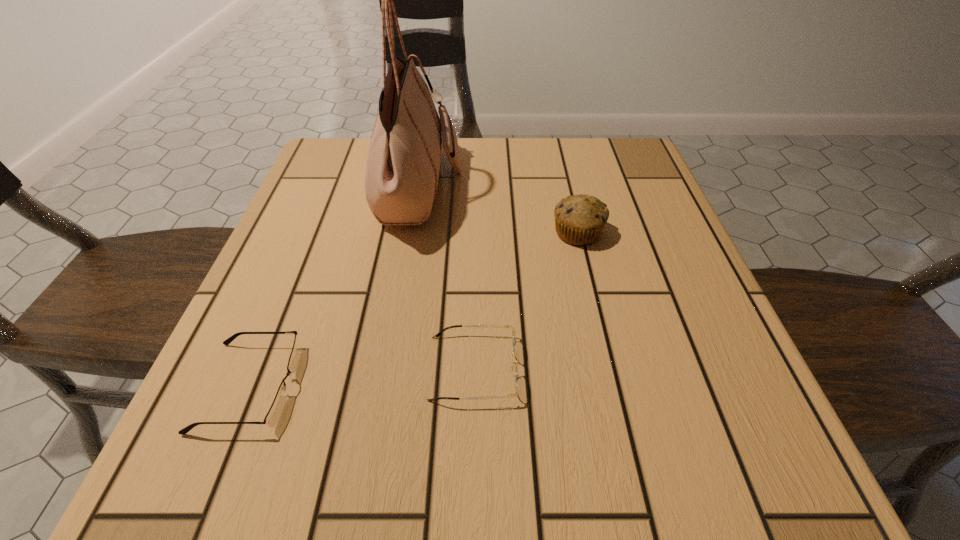
Point out which object is positioned as the nearest to the handbag. Please provide its 2D coordinates. Your answer should be formatted as a tuple, i.e. [(x, y)], where the tuple contains the x and y coordinates of a point satisfying the conditions above.

[(579, 219)]

Select which object appears as the closest to the tallest object. Please provide its 2D coordinates. Your answer should be formatted as a tuple, i.e. [(x, y)], where the tuple contains the x and y coordinates of a point satisfying the conditions above.

[(579, 219)]

The width and height of the screenshot is (960, 540). I want to click on vacant space that satisfies the following two spatial constraints: 1. on the back side of the second tallest object; 2. on the side of the handbag with the attached pouch, so click(566, 188).

Where is `blank space that satisfies the following two spatial constraints: 1. on the side of the tallest object with the attached pouch; 2. on the right side of the rightmost object`? The height and width of the screenshot is (540, 960). blank space that satisfies the following two spatial constraints: 1. on the side of the tallest object with the attached pouch; 2. on the right side of the rightmost object is located at coordinates (413, 233).

In order to click on blank area in the image that satisfies the following two spatial constraints: 1. on the side of the tallest object with the attached pouch; 2. on the left side of the rightmost object in this screenshot , I will do `click(413, 233)`.